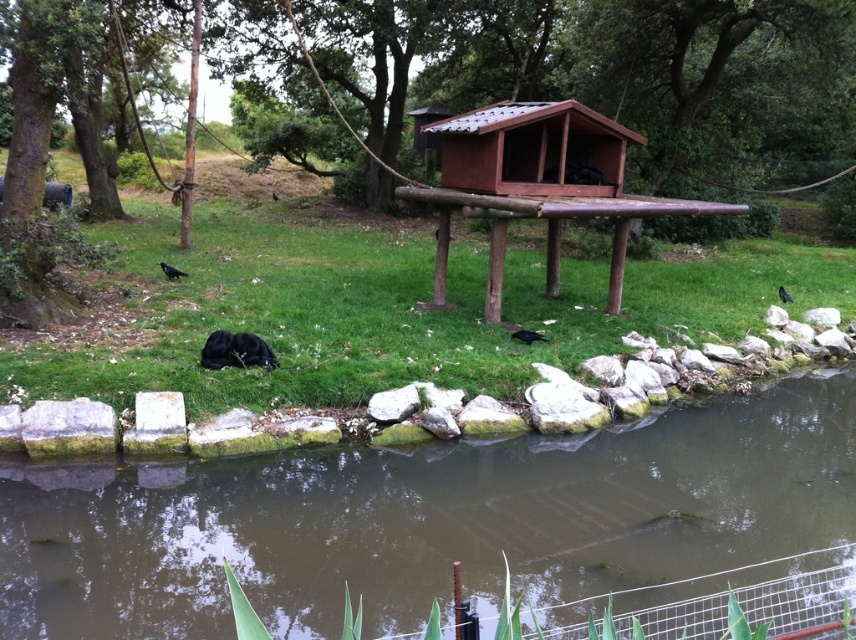
Question: Does brown murky water at lower center have a larger size compared to black feathered bird at lower right?

Choices:
 (A) no
 (B) yes

Answer: (B)

Question: Among these objects, which one is nearest to the camera?

Choices:
 (A) brown wooden hut at center
 (B) black feathered bird at lower right
 (C) brown murky water at lower center
 (D) black matte bird at lower center

Answer: (C)

Question: Can you confirm if brown murky water at lower center is positioned to the right of black fur animal at lower center?

Choices:
 (A) yes
 (B) no

Answer: (B)

Question: Which point is closer to the camera?

Choices:
 (A) (513, 332)
 (B) (615, 212)
 (C) (559, 141)

Answer: (B)

Question: Which object is farther from the camera taking this photo?

Choices:
 (A) green grass at center
 (B) brown wooden hut at center

Answer: (B)

Question: Is brown murky water at lower center bigger than brown wooden hut at center?

Choices:
 (A) yes
 (B) no

Answer: (B)